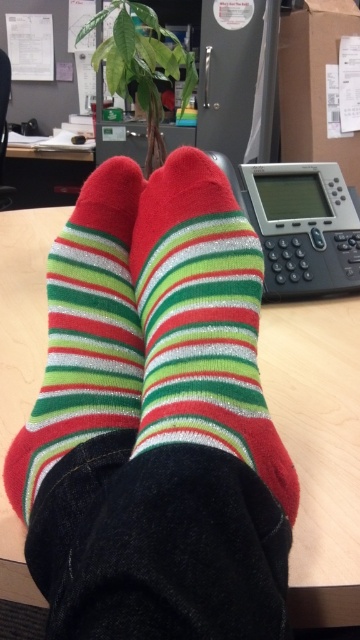
Does shiny red socks at center have a lesser width compared to shiny red-green-striped socks at center?

Yes.

Is shiny red socks at center smaller than shiny red-green-striped socks at center?

Indeed, shiny red socks at center has a smaller size compared to shiny red-green-striped socks at center.

This screenshot has width=360, height=640. I want to click on shiny red socks at center, so click(x=203, y=321).

This screenshot has width=360, height=640. Find the location of `shiny red socks at center`. shiny red socks at center is located at coordinates 203,321.

Can you confirm if wooden table at center is positioned above shiny red socks at center?

Indeed, wooden table at center is positioned over shiny red socks at center.

Identify the location of wooden table at center. The image size is (360, 640). (318, 449).

Which is in front, point (1, 348) or point (168, 205)?

Point (168, 205)

At what (x,y) coordinates should I click in order to perform the action: click on wooden table at center. Please return your answer as a coordinate pair (x, y). This screenshot has height=640, width=360. Looking at the image, I should click on (318, 449).

Which of these two, wooden table at center or shiny red-green-striped socks at center, stands taller?

Standing taller between the two is wooden table at center.

Between point (354, 563) and point (81, 358), which one is positioned behind?

The point (81, 358) is behind.

You are a GUI agent. You are given a task and a screenshot of the screen. Output one action in this format:
    pyautogui.click(x=<x>, y=<y>)
    Task: Click on the wooden table at center
    
    Given the screenshot: What is the action you would take?
    click(318, 449)